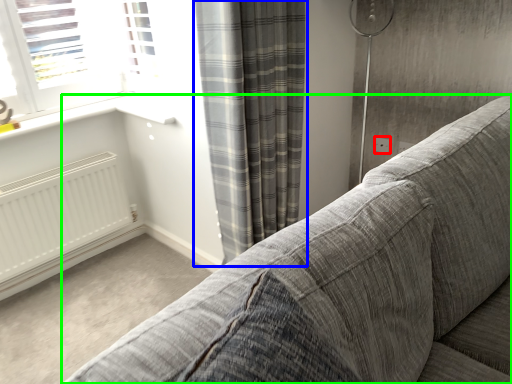
Question: Which object is the farthest from electric outlet (highlighted by a red box)? Choose among these: curtain (highlighted by a blue box) or studio couch (highlighted by a green box).

Choices:
 (A) curtain
 (B) studio couch

Answer: (B)